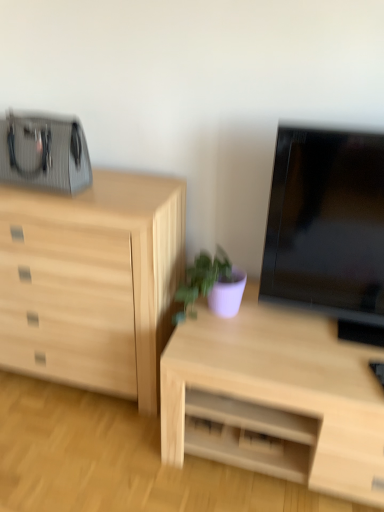
Question: Is purple matte plant at center positioned in front of natural wood chest of drawers at left?

Choices:
 (A) yes
 (B) no

Answer: (B)

Question: Is purple matte plant at center shorter than natural wood chest of drawers at left?

Choices:
 (A) no
 (B) yes

Answer: (B)

Question: Can you confirm if purple matte plant at center is taller than natural wood chest of drawers at left?

Choices:
 (A) yes
 (B) no

Answer: (B)

Question: Can you confirm if purple matte plant at center is thinner than natural wood chest of drawers at left?

Choices:
 (A) no
 (B) yes

Answer: (B)

Question: Is purple matte plant at center outside of natural wood chest of drawers at left?

Choices:
 (A) yes
 (B) no

Answer: (A)

Question: Considering their positions, is black glossy tv at right located in front of or behind purple matte plant at center?

Choices:
 (A) behind
 (B) front

Answer: (B)

Question: From a real-world perspective, is black glossy tv at right positioned above or below purple matte plant at center?

Choices:
 (A) below
 (B) above

Answer: (B)

Question: Looking at the image, does black glossy tv at right seem bigger or smaller compared to purple matte plant at center?

Choices:
 (A) big
 (B) small

Answer: (A)

Question: In the image, is black glossy tv at right on the left side or the right side of purple matte plant at center?

Choices:
 (A) left
 (B) right

Answer: (B)

Question: Is black glossy tv at right inside or outside of light wood desk at center?

Choices:
 (A) inside
 (B) outside

Answer: (B)

Question: In terms of size, does black glossy tv at right appear bigger or smaller than light wood desk at center?

Choices:
 (A) big
 (B) small

Answer: (B)

Question: In the image, is black glossy tv at right positioned in front of or behind light wood desk at center?

Choices:
 (A) behind
 (B) front

Answer: (B)

Question: Considering the relative positions of black glossy tv at right and light wood desk at center in the image provided, is black glossy tv at right to the left or to the right of light wood desk at center?

Choices:
 (A) left
 (B) right

Answer: (B)

Question: From the image's perspective, is purple matte plant at center above or below light wood desk at center?

Choices:
 (A) above
 (B) below

Answer: (A)

Question: From a real-world perspective, is purple matte plant at center above or below light wood desk at center?

Choices:
 (A) below
 (B) above

Answer: (B)